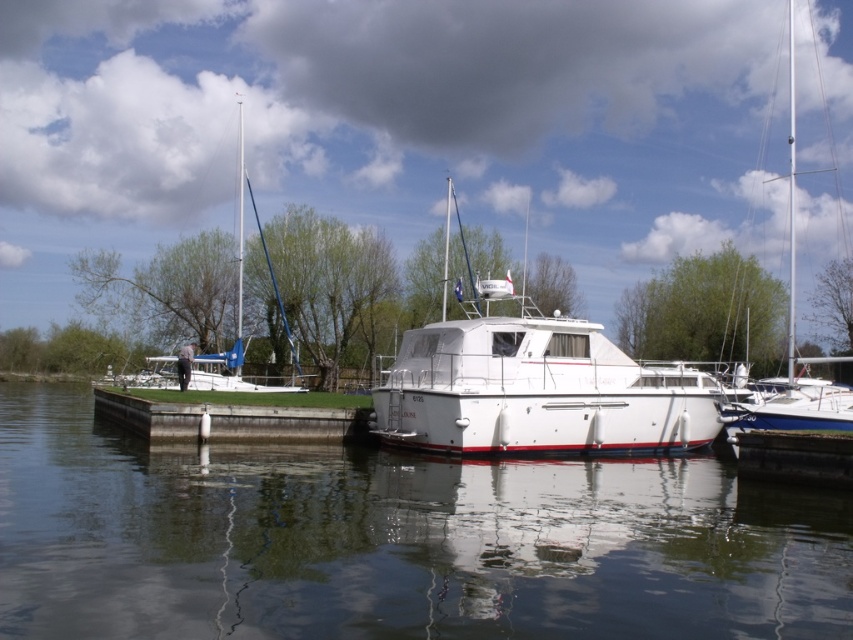
Who is shorter, white glossy boat at center or white glossy sailboat at left?

→ With less height is white glossy boat at center.

Does white glossy boat at center have a smaller size compared to white glossy sailboat at left?

Correct, white glossy boat at center occupies less space than white glossy sailboat at left.

This screenshot has width=853, height=640. What are the coordinates of `white glossy boat at center` in the screenshot? It's located at (537, 387).

You are a GUI agent. You are given a task and a screenshot of the screen. Output one action in this format:
    pyautogui.click(x=<x>, y=<y>)
    Task: Click on the white glossy boat at center
    
    Given the screenshot: What is the action you would take?
    pos(537,387)

Which is below, white glossy boat at center or white glossy sailboat at right?

white glossy boat at center is below.

The width and height of the screenshot is (853, 640). I want to click on white glossy boat at center, so click(x=537, y=387).

Which is in front, point (585, 356) or point (788, 8)?

Point (585, 356)

Image resolution: width=853 pixels, height=640 pixels. I want to click on white glossy boat at center, so click(537, 387).

Who is positioned more to the right, transparent water at center or white glossy boat at center?

white glossy boat at center is more to the right.

In order to click on transparent water at center in this screenshot , I will do `click(393, 541)`.